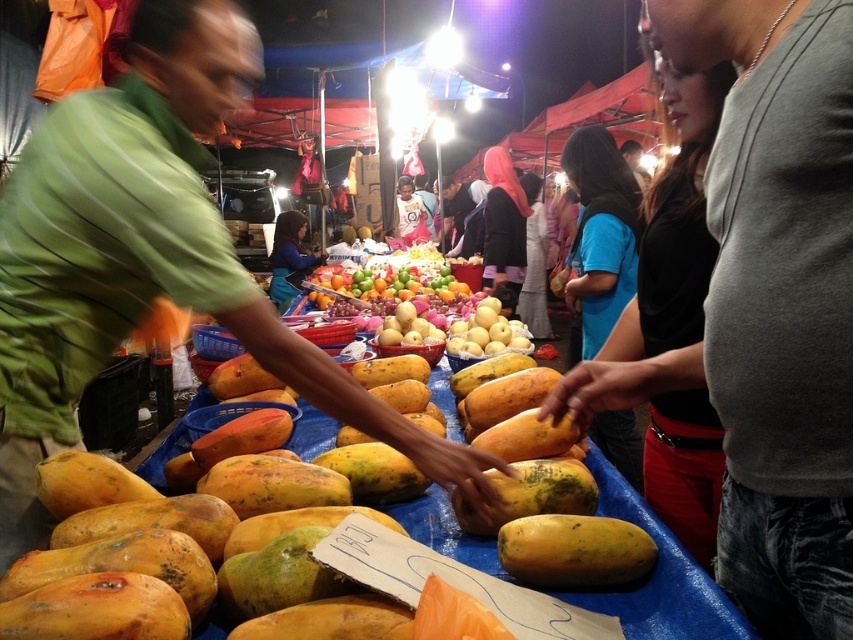
You are a customer at the night market and want to buy the yellow smooth mangoes at center. The vendor is standing behind the blue fabric apron at center. Can you see the mangoes without the apron blocking your view?

The yellow smooth mangoes at center is in front of the blue fabric apron at center, so you can see the mangoes without the apron blocking your view.

You are a customer at this night market stall. You see the glossy plastic fruits at center and the yellow smooth mangoes at center. Which item is positioned higher up?

The glossy plastic fruits at center are located above the yellow smooth mangoes at center, so they are positioned higher up.

You are a customer at the night market and want to buy the yellow smooth mangoes at center. The vendor tells you that the glossy plastic fruits at center are just decorations. How can you tell the difference between the two based on their height?

The glossy plastic fruits at center are much taller than the yellow smooth mangoes at center, so the taller ones are the decorations.